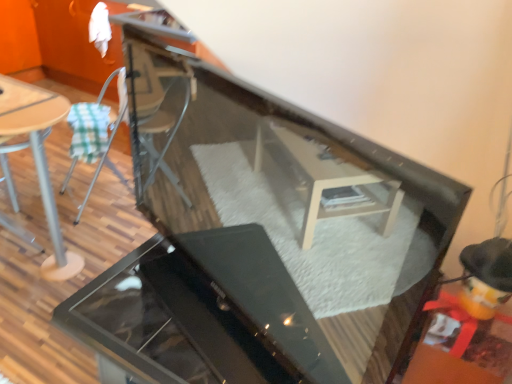
At what (x,y) coordinates should I click in order to perform the action: click on blank space situated above glossy black grill at center (from a real-world perspective). Please return your answer as a coordinate pair (x, y). The width and height of the screenshot is (512, 384). Looking at the image, I should click on pos(177,304).